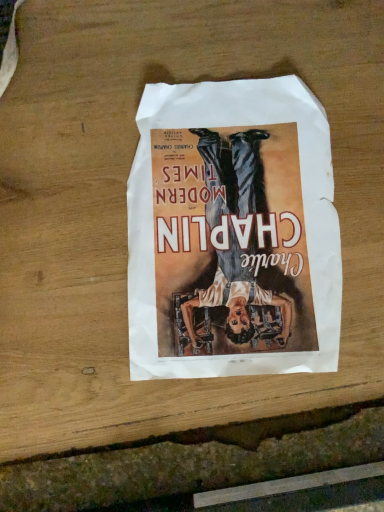
Locate an element on the screen. The image size is (384, 512). empty space that is ontop of matte paper poster at center is located at coordinates (233, 218).